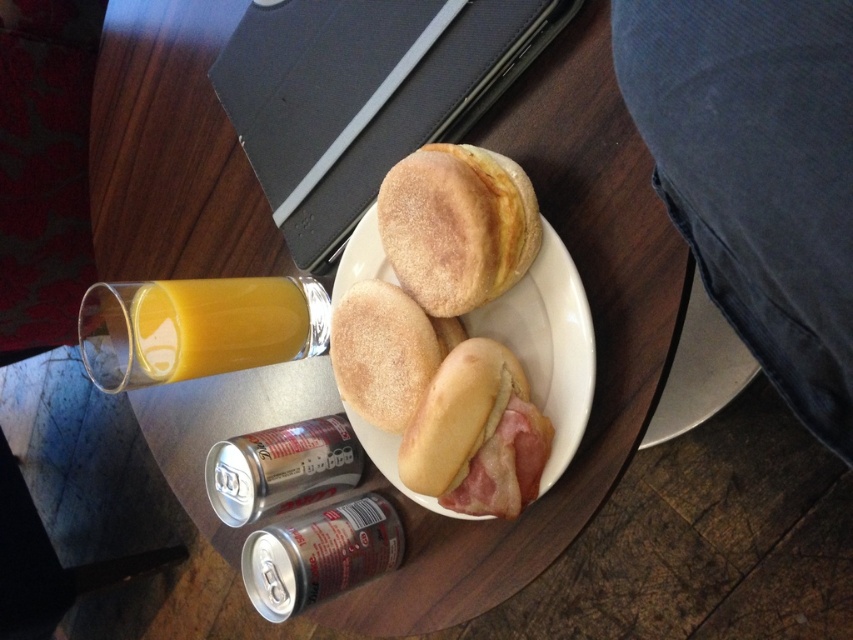
You are a chef trying to place a new dish on the table. The dish is 18 inches wide. You see the point at (521, 198). Can you fit the dish between the white plate and the orange juice glass without overlapping them?

The distance between the white plate and the orange juice glass is 19.70 inches. Since the dish is 18 inches wide, it can fit between them without overlapping.

You are sitting at the wooden table and want to reach both the orange juice and the bacon. The orange juice is located at point [126,28] and the bacon is at point [466,445]. Which item is closer to you?

Point [126,28] is behind point [466,445], so the orange juice at point [126,28] is farther away from you. Therefore, the bacon at point [466,445] is closer to you.

You are arranging a breakfast plate and have both the golden brown muffins at center and the golden brown bread at center. If you want to place them in a row from left to right, which one should you put first?

The golden brown muffins at center should be placed first on the left side since they are positioned on the left side of the golden brown bread at center in the image.